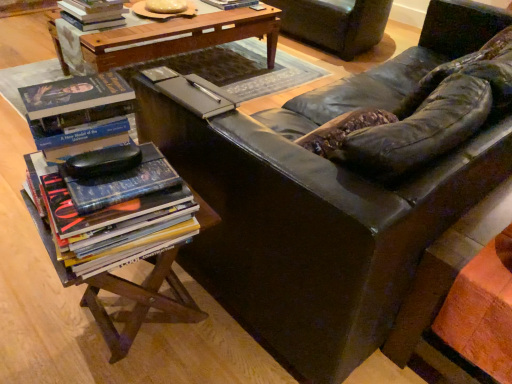
Question: From a real-world perspective, is hardcover book at upper left, which is the second book in bottom-to-top order, located beneath woodenmaterial/texturetable at lower left, arranged as the first table when viewed from the front?

Choices:
 (A) yes
 (B) no

Answer: (B)

Question: From a real-world perspective, is hardcover book at upper left, marked as the 1th book in a left-to-right arrangement, on top of woodenmaterial/texturetable at lower left, the first table in the bottom-to-top sequence?

Choices:
 (A) no
 (B) yes

Answer: (B)

Question: Can you confirm if hardcover book at upper left, which is the second book in bottom-to-top order, is positioned to the right of woodenmaterial/texturetable at lower left, marked as the second table in a back-to-front arrangement?

Choices:
 (A) no
 (B) yes

Answer: (A)

Question: Is there a large distance between hardcover book at upper left, which is the 2th book from back to front, and woodenmaterial/texturetable at lower left, the first table in the bottom-to-top sequence?

Choices:
 (A) no
 (B) yes

Answer: (B)

Question: Is the surface of hardcover book at upper left, positioned as the second book in top-to-bottom order, in direct contact with woodenmaterial/texturetable at lower left, the first table in the bottom-to-top sequence?

Choices:
 (A) no
 (B) yes

Answer: (A)

Question: Does hardcover book at upper left, which is the second book in bottom-to-top order, lie in front of woodenmaterial/texturetable at lower left, the first table in the bottom-to-top sequence?

Choices:
 (A) no
 (B) yes

Answer: (A)

Question: From a real-world perspective, is hardcover book at upper center, arranged as the first book when viewed from the top, located beneath matte black leather couch at center?

Choices:
 (A) yes
 (B) no

Answer: (B)

Question: Are hardcover book at upper center, placed as the first book when sorted from right to left, and matte black leather couch at center beside each other?

Choices:
 (A) no
 (B) yes

Answer: (A)

Question: Is matte black leather couch at center a part of hardcover book at upper center, positioned as the third book in left-to-right order?

Choices:
 (A) no
 (B) yes

Answer: (A)

Question: Does hardcover book at upper center, which is counted as the 3th book, starting from the front, lie behind matte black leather couch at center?

Choices:
 (A) yes
 (B) no

Answer: (A)

Question: Is hardcover book at upper center, which is counted as the 3th book, starting from the front, far from matte black leather couch at center?

Choices:
 (A) no
 (B) yes

Answer: (B)

Question: Is hardcover book at upper center, arranged as the first book when viewed from the back, wider than matte black leather couch at center?

Choices:
 (A) yes
 (B) no

Answer: (B)

Question: Considering the relative sizes of woodenmaterial/texturetable at lower left, the first table in the bottom-to-top sequence, and hardcover book at upper center, placed as the first book when sorted from right to left, in the image provided, is woodenmaterial/texturetable at lower left, the first table in the bottom-to-top sequence, bigger than hardcover book at upper center, placed as the first book when sorted from right to left,?

Choices:
 (A) yes
 (B) no

Answer: (A)